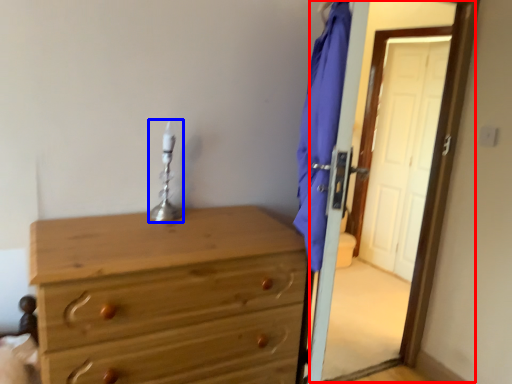
Question: Among these objects, which one is nearest to the camera, screen door (highlighted by a red box) or table lamp (highlighted by a blue box)?

Choices:
 (A) screen door
 (B) table lamp

Answer: (A)